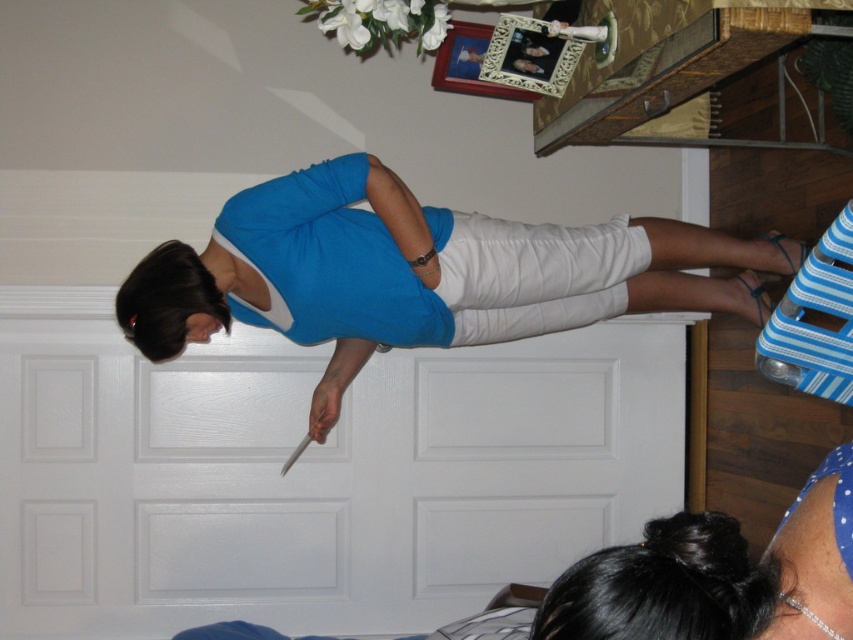
Question: Among these objects, which one is nearest to the camera?

Choices:
 (A) blue cotton dress at center
 (B) matte blue fabric dress at center

Answer: (A)

Question: Among these objects, which one is nearest to the camera?

Choices:
 (A) blue cotton dress at center
 (B) matte blue fabric dress at center

Answer: (A)

Question: Observing the image, what is the correct spatial positioning of blue cotton dress at center in reference to matte blue fabric dress at center?

Choices:
 (A) below
 (B) above

Answer: (A)

Question: In this image, where is blue cotton dress at center located relative to matte blue fabric dress at center?

Choices:
 (A) below
 (B) above

Answer: (A)

Question: Can you confirm if blue cotton dress at center is positioned to the left of matte blue fabric dress at center?

Choices:
 (A) no
 (B) yes

Answer: (A)

Question: Among these points, which one is farthest from the camera?

Choices:
 (A) (248, 257)
 (B) (666, 266)

Answer: (B)